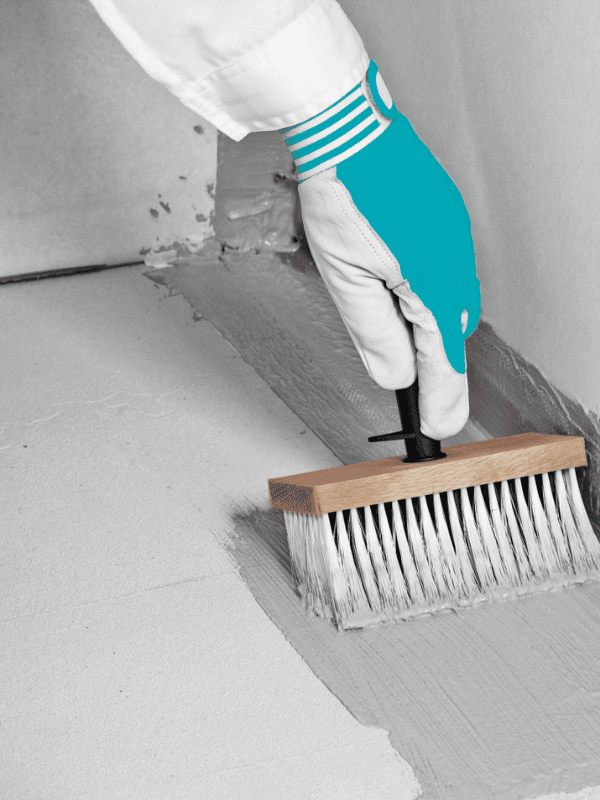
Where is `wall`? The width and height of the screenshot is (600, 800). wall is located at coordinates (528, 244).